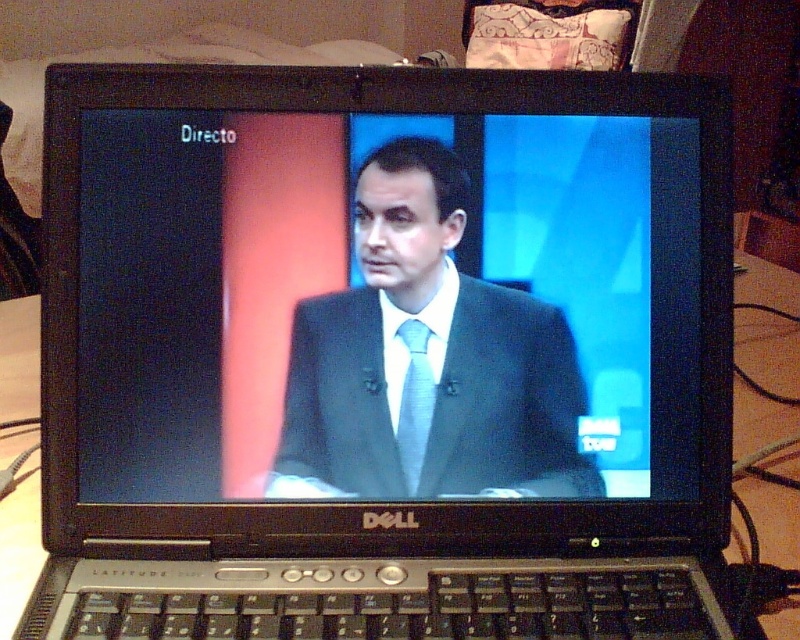
Question: Is matte black suit at center closer to camera compared to light blue silk tie at center?

Choices:
 (A) no
 (B) yes

Answer: (A)

Question: Which object appears closest to the camera in this image?

Choices:
 (A) matte black suit at center
 (B) light blue silk tie at center

Answer: (B)

Question: Does matte black suit at center appear on the right side of light blue silk tie at center?

Choices:
 (A) yes
 (B) no

Answer: (A)

Question: Can you confirm if matte black suit at center is positioned to the left of light blue silk tie at center?

Choices:
 (A) no
 (B) yes

Answer: (A)

Question: Among these objects, which one is nearest to the camera?

Choices:
 (A) light blue silk tie at center
 (B) matte black suit at center

Answer: (A)